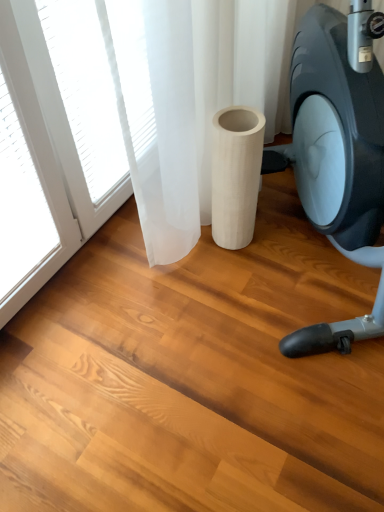
Question: Relative to matte black stationary bicycle at right, is white wood cylinder at center in front or behind?

Choices:
 (A) behind
 (B) front

Answer: (A)

Question: From a real-world perspective, is white wood cylinder at center above or below matte black stationary bicycle at right?

Choices:
 (A) above
 (B) below

Answer: (B)

Question: Would you say white wood cylinder at center is inside or outside matte black stationary bicycle at right?

Choices:
 (A) outside
 (B) inside

Answer: (B)

Question: Is point (340, 349) positioned closer to the camera than point (240, 150)?

Choices:
 (A) closer
 (B) farther

Answer: (B)

Question: From their relative heights in the image, would you say matte black stationary bicycle at right is taller or shorter than white wood cylinder at center?

Choices:
 (A) short
 (B) tall

Answer: (B)

Question: Looking at their shapes, would you say matte black stationary bicycle at right is wider or thinner than white wood cylinder at center?

Choices:
 (A) wide
 (B) thin

Answer: (A)

Question: From the image's perspective, is matte black stationary bicycle at right located above or below white wood cylinder at center?

Choices:
 (A) above
 (B) below

Answer: (A)